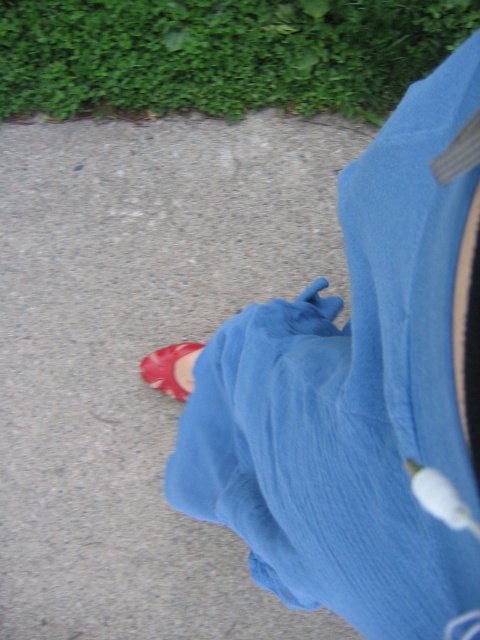
You are a photographer adjusting your camera to focus on two points in the image. The first point is at coordinates point [69,216] and the second point is at point [180,387]. Which point should you focus on first if you want to capture the closest object to the camera?

Point [69,216] is further to the camera than point [180,387], so you should focus on point [69,216] first as it is closer to the camera.